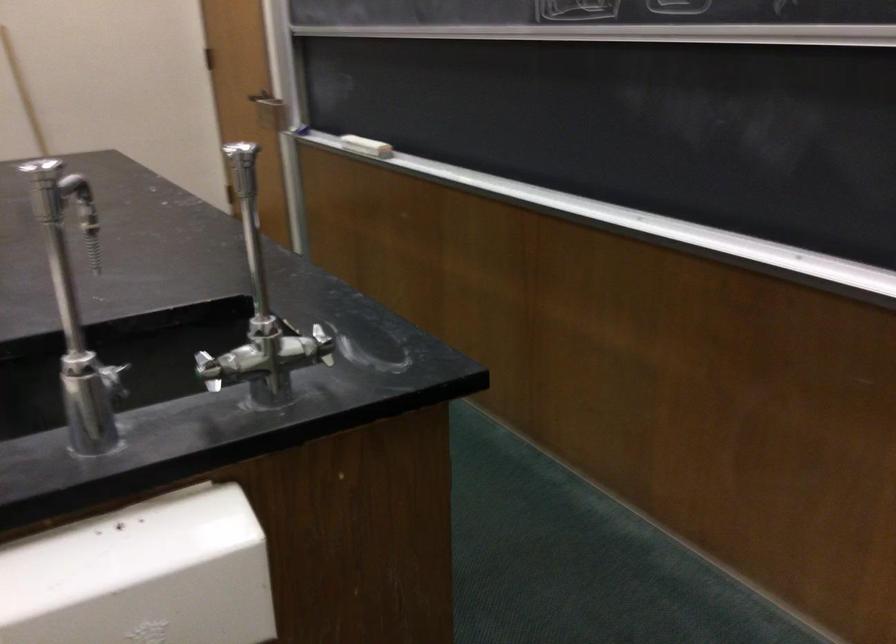
Find where to pull the door handle. Please return your answer as a coordinate pair (x, y).

(269, 109)